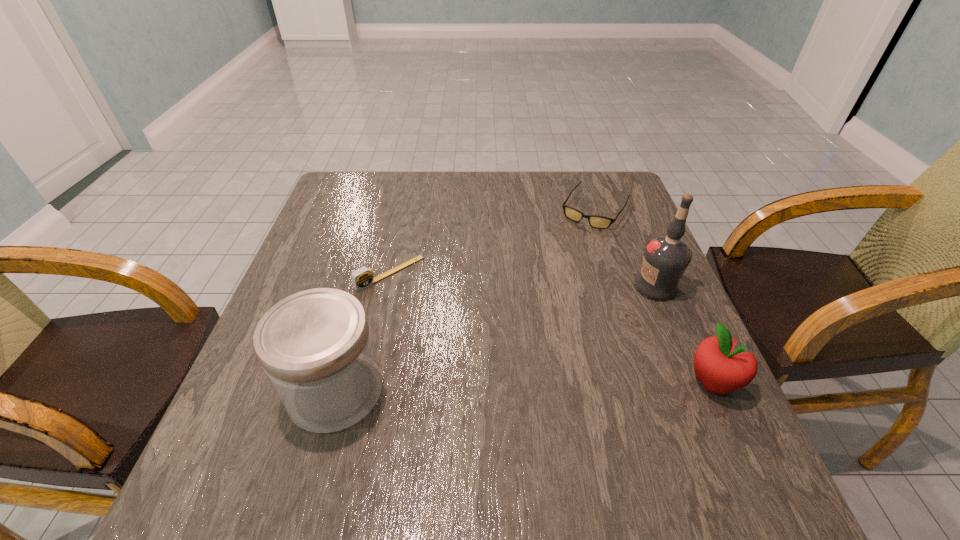
Where is `the second tallest object`? the second tallest object is located at coordinates (316, 348).

Locate an element on the screen. the third tallest object is located at coordinates (721, 370).

Image resolution: width=960 pixels, height=540 pixels. I want to click on vodka, so click(666, 257).

You are a GUI agent. You are given a task and a screenshot of the screen. Output one action in this format:
    pyautogui.click(x=<x>, y=<y>)
    Task: Click on the tape measure
    The width and height of the screenshot is (960, 540).
    Given the screenshot: What is the action you would take?
    pyautogui.click(x=362, y=278)

This screenshot has width=960, height=540. I want to click on the farthest object, so click(x=595, y=221).

The width and height of the screenshot is (960, 540). In order to click on vacant area situated 0.140m on the right of the jar in this screenshot , I will do `click(456, 391)`.

Where is `free space located 0.250m on the back of the apple`? The height and width of the screenshot is (540, 960). free space located 0.250m on the back of the apple is located at coordinates (665, 276).

Image resolution: width=960 pixels, height=540 pixels. Identify the location of vacant area located 0.260m on the front label of the tallest object. (555, 343).

Find the location of `free spot located on the front label of the tallest object`. free spot located on the front label of the tallest object is located at coordinates (620, 307).

Locate an element on the screen. The image size is (960, 540). blank area located on the front label of the tallest object is located at coordinates (626, 303).